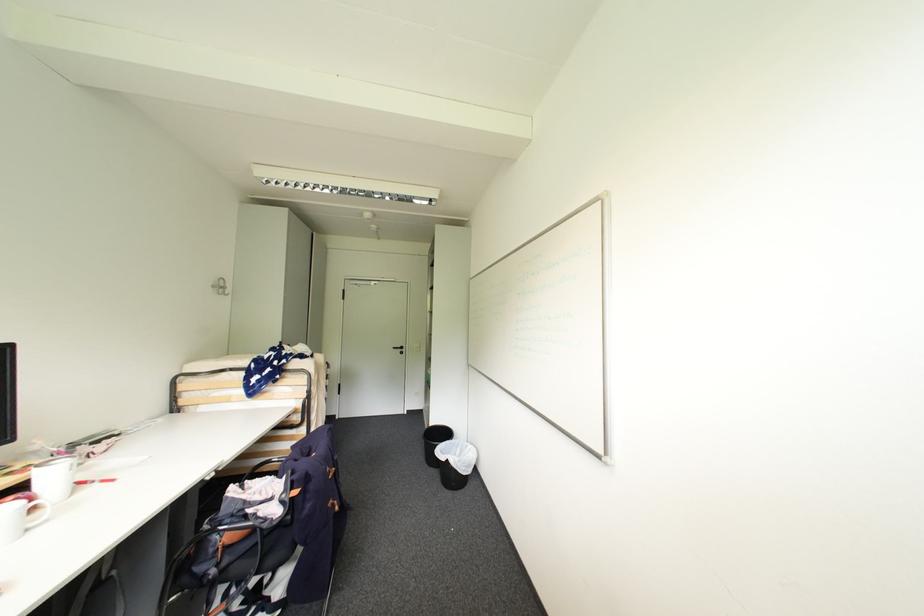
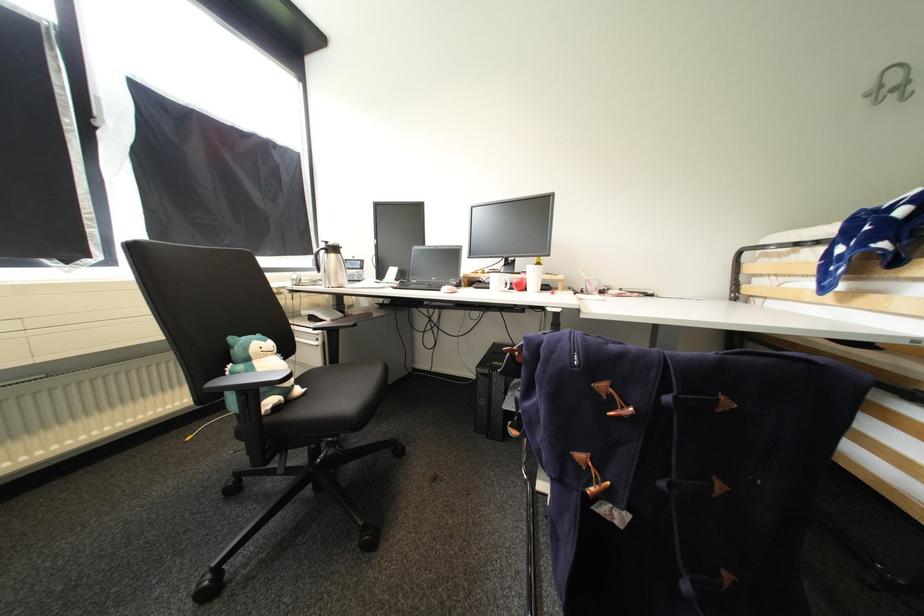
Locate, in the second image, the point that corresponds to [78,469] in the first image.

(541, 273)